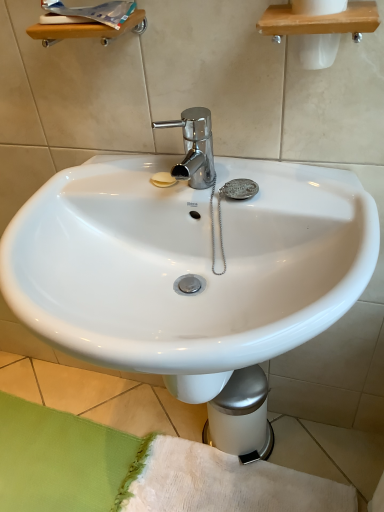
Where is `free region under white glossy sink at center (from a real-world perspective)`? free region under white glossy sink at center (from a real-world perspective) is located at coordinates (203, 474).